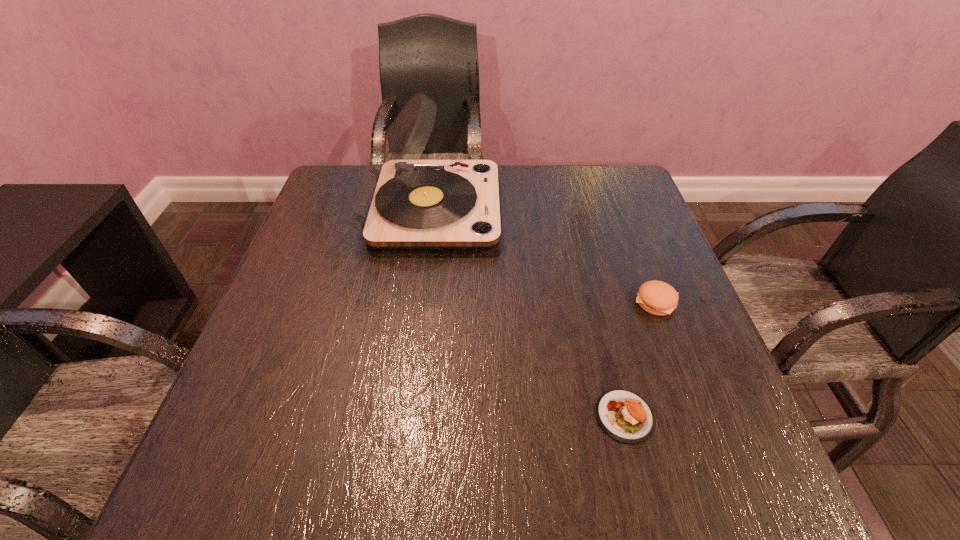
The width and height of the screenshot is (960, 540). In order to click on vacant area in the image that satisfies the following two spatial constraints: 1. with the tonearm facing the front of the tallest object; 2. on the left side of the shortest object in this screenshot , I will do `click(404, 416)`.

You are a GUI agent. You are given a task and a screenshot of the screen. Output one action in this format:
    pyautogui.click(x=<x>, y=<y>)
    Task: Click on the vacant area that satisfies the following two spatial constraints: 1. with the tonearm facing the front of the leftmost object; 2. on the right side of the second farthest object
    
    Given the screenshot: What is the action you would take?
    pyautogui.click(x=420, y=301)

This screenshot has height=540, width=960. I want to click on blank area in the image that satisfies the following two spatial constraints: 1. on the back side of the right patty (food); 2. on the right side of the shortest object, so click(x=596, y=301).

Locate an element on the screen. Image resolution: width=960 pixels, height=540 pixels. vacant space that satisfies the following two spatial constraints: 1. on the back side of the taller patty (food); 2. on the right side of the left patty (food) is located at coordinates (596, 301).

Identify the location of vacant space that satisfies the following two spatial constraints: 1. on the back side of the farther patty (food); 2. with the tonearm facing the front of the leftmost object. (621, 209).